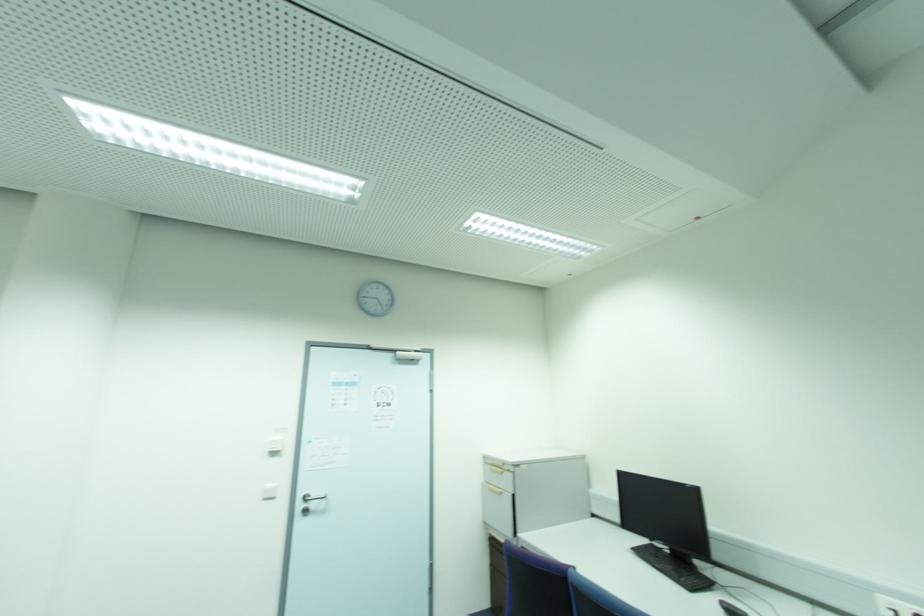
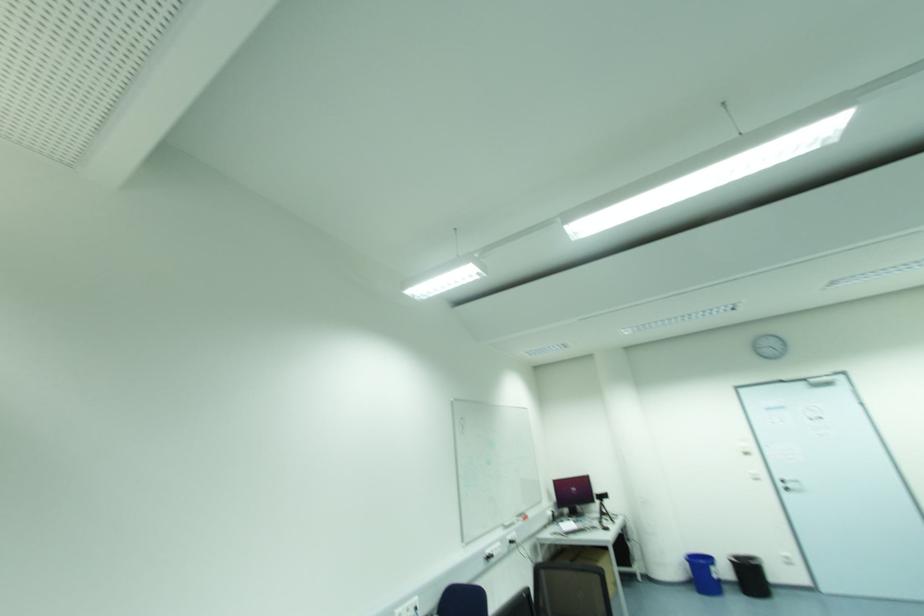
In the second image, find the point that corresponds to pixel 311 506 in the first image.

(789, 485)